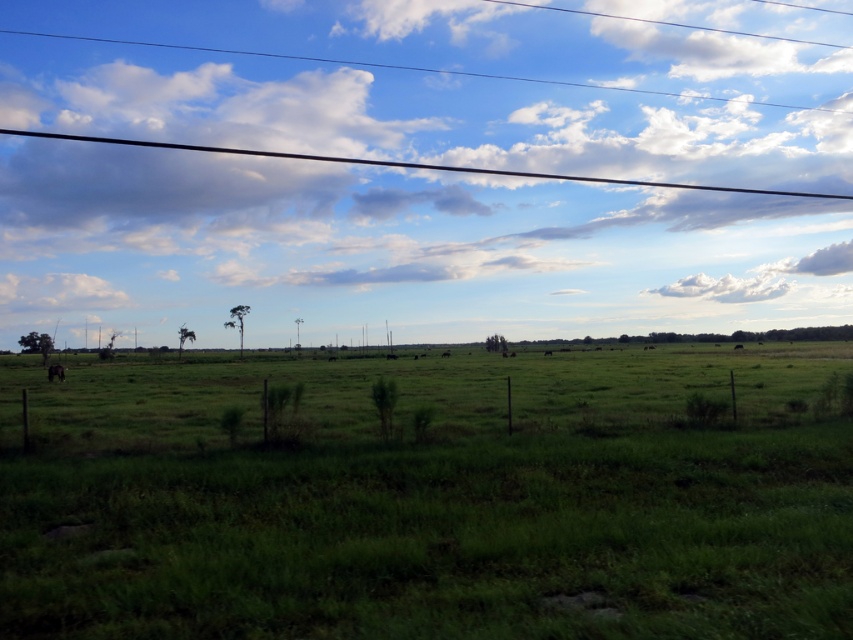
Question: From the image, what is the correct spatial relationship of white fluffy cloud at upper left in relation to brown furry cow at lower left?

Choices:
 (A) right
 (B) left

Answer: (B)

Question: Is white fluffy cloud at upper left positioned at the back of brown furry cow at lower left?

Choices:
 (A) yes
 (B) no

Answer: (A)

Question: Which of the following is the closest to the observer?

Choices:
 (A) brown furry cow at lower left
 (B) white fluffy cloud at upper left

Answer: (A)

Question: Can you confirm if white fluffy cloud at upper left is wider than brown furry cow at lower left?

Choices:
 (A) no
 (B) yes

Answer: (B)